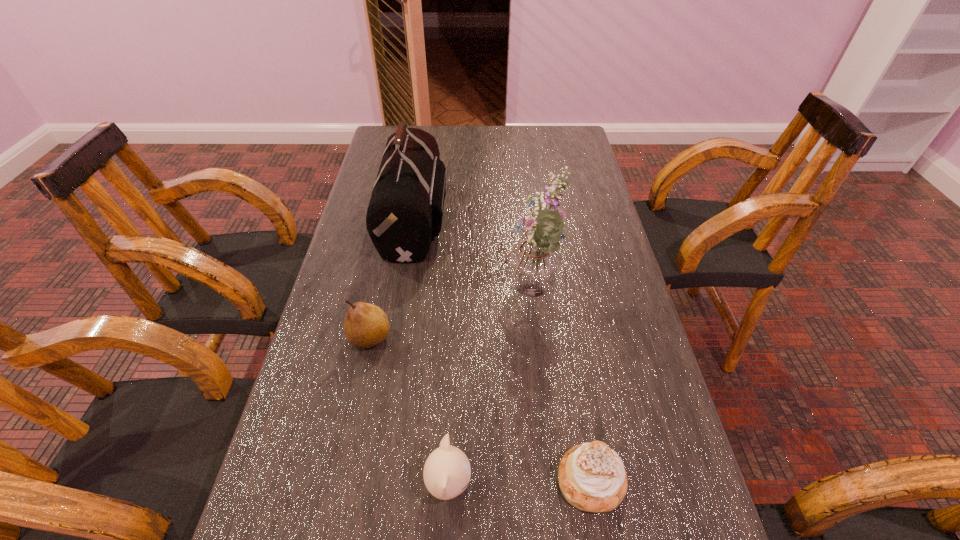
Locate an element on the screen. object that stands as the third closest to the pastry is located at coordinates (366, 325).

At what (x,y) coordinates should I click in order to perform the action: click on vacant region that satisfies the following two spatial constraints: 1. on the front pocket of the duffel bag; 2. on the left side of the pastry. Please return your answer as a coordinate pair (x, y). The height and width of the screenshot is (540, 960). Looking at the image, I should click on (372, 481).

Image resolution: width=960 pixels, height=540 pixels. Find the location of `free space that satisfies the following two spatial constraints: 1. on the front side of the pastry; 2. on the left side of the third shortest object`. free space that satisfies the following two spatial constraints: 1. on the front side of the pastry; 2. on the left side of the third shortest object is located at coordinates (340, 481).

You are a GUI agent. You are given a task and a screenshot of the screen. Output one action in this format:
    pyautogui.click(x=<x>, y=<y>)
    Task: Click on the blank space that satisfies the following two spatial constraints: 1. on the front-facing side of the bouquet; 2. on the right side of the pastry
    The height and width of the screenshot is (540, 960).
    Given the screenshot: What is the action you would take?
    pyautogui.click(x=551, y=481)

This screenshot has height=540, width=960. Identify the location of free space that satisfies the following two spatial constraints: 1. on the front pocket of the pastry; 2. on the right side of the duffel bag. pos(372,481).

This screenshot has width=960, height=540. I want to click on free location that satisfies the following two spatial constraints: 1. on the front pocket of the fourth shortest object; 2. on the left side of the pastry, so click(x=372, y=481).

Where is `blank area in the image that satisfies the following two spatial constraints: 1. on the front-facing side of the pastry; 2. on the right side of the bouquet`? blank area in the image that satisfies the following two spatial constraints: 1. on the front-facing side of the pastry; 2. on the right side of the bouquet is located at coordinates (551, 481).